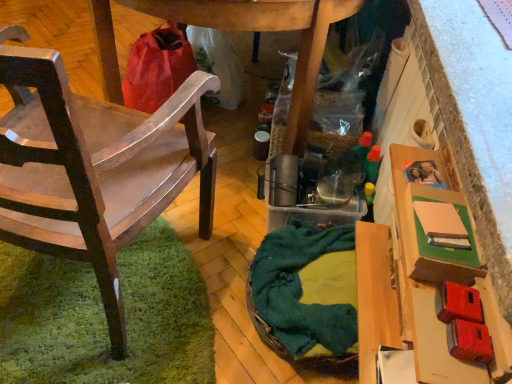
Question: Is matte brown cardboard box at right turned away from wooden chair at left?

Choices:
 (A) no
 (B) yes

Answer: (A)

Question: Is matte brown cardboard box at right outside of wooden chair at left?

Choices:
 (A) yes
 (B) no

Answer: (A)

Question: Considering the relative sizes of matte brown cardboard box at right and wooden chair at left in the image provided, is matte brown cardboard box at right shorter than wooden chair at left?

Choices:
 (A) no
 (B) yes

Answer: (B)

Question: From a real-world perspective, is matte brown cardboard box at right positioned over wooden chair at left based on gravity?

Choices:
 (A) no
 (B) yes

Answer: (A)

Question: From the image's perspective, is matte brown cardboard box at right located above wooden chair at left?

Choices:
 (A) yes
 (B) no

Answer: (B)

Question: From the image's perspective, is matte brown cardboard box at right located above or below wooden chair at left?

Choices:
 (A) above
 (B) below

Answer: (B)

Question: Looking at the image, does matte brown cardboard box at right seem bigger or smaller compared to wooden chair at left?

Choices:
 (A) big
 (B) small

Answer: (B)

Question: Looking at their shapes, would you say matte brown cardboard box at right is wider or thinner than wooden chair at left?

Choices:
 (A) wide
 (B) thin

Answer: (B)

Question: In the image, is matte brown cardboard box at right positioned in front of or behind wooden chair at left?

Choices:
 (A) behind
 (B) front

Answer: (A)

Question: From the image's perspective, is wooden chair at left above or below matte brown cardboard box at right?

Choices:
 (A) below
 (B) above

Answer: (B)

Question: From a real-world perspective, is wooden chair at left physically located above or below matte brown cardboard box at right?

Choices:
 (A) below
 (B) above

Answer: (B)

Question: Which is correct: wooden chair at left is inside matte brown cardboard box at right, or outside of it?

Choices:
 (A) inside
 (B) outside

Answer: (B)

Question: Is wooden chair at left wider or thinner than matte brown cardboard box at right?

Choices:
 (A) thin
 (B) wide

Answer: (B)

Question: In terms of width, does matte brown cardboard box at right look wider or thinner when compared to green woven basket at center?

Choices:
 (A) thin
 (B) wide

Answer: (A)

Question: Is matte brown cardboard box at right situated inside green woven basket at center or outside?

Choices:
 (A) inside
 (B) outside

Answer: (B)